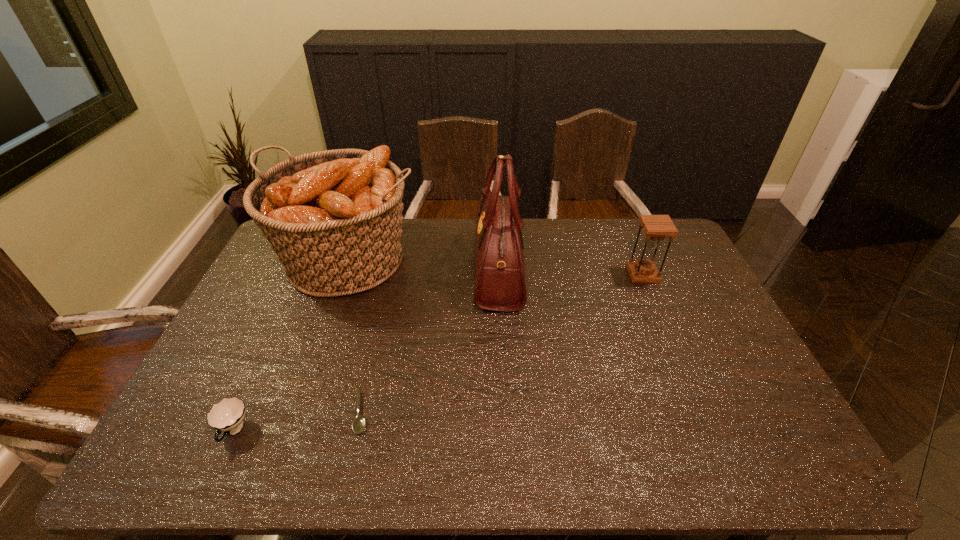
Locate an element on the screen. Image resolution: width=960 pixels, height=540 pixels. the fourth object from left to right is located at coordinates [500, 285].

The width and height of the screenshot is (960, 540). Identify the location of basket. (334, 217).

The height and width of the screenshot is (540, 960). I want to click on the third tallest object, so click(656, 227).

The height and width of the screenshot is (540, 960). What are the coordinates of `hourglass` in the screenshot? It's located at (656, 227).

Locate an element on the screen. the fourth tallest object is located at coordinates (227, 416).

You are a GUI agent. You are given a task and a screenshot of the screen. Output one action in this format:
    pyautogui.click(x=<x>, y=<y>)
    Task: Click on the soupspoon
    The width and height of the screenshot is (960, 540).
    Given the screenshot: What is the action you would take?
    pyautogui.click(x=359, y=423)

I want to click on free space located on the front-facing side of the handbag, so click(411, 268).

Find the location of `free space located 0.310m on the front-facing side of the handbag`. free space located 0.310m on the front-facing side of the handbag is located at coordinates (385, 268).

At what (x,y) coordinates should I click in order to perform the action: click on vacant region located 0.200m on the front-facing side of the handbag. Please return your answer as a coordinate pair (x, y). The image size is (960, 540). Looking at the image, I should click on (417, 268).

I want to click on vacant space located 0.400m on the right of the basket, so click(x=535, y=261).